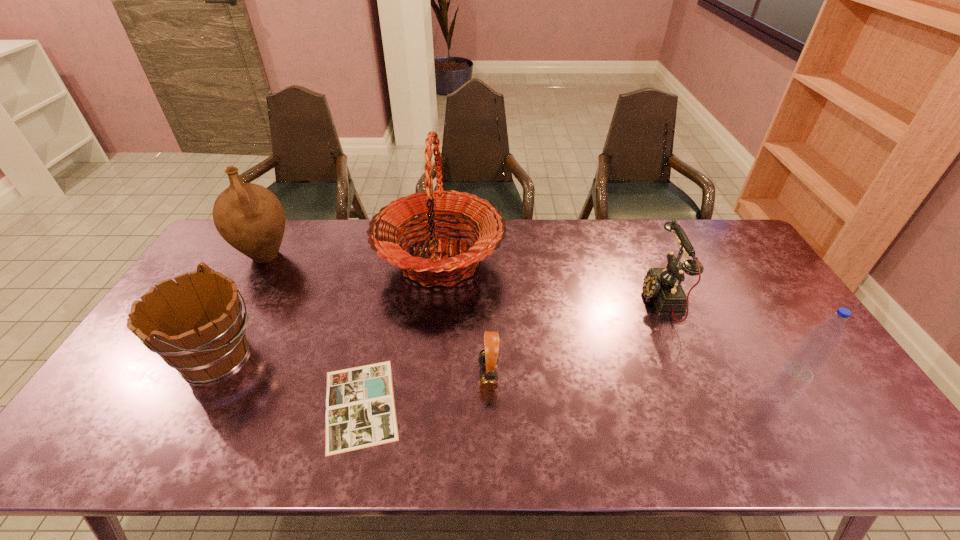
Identify the location of free spot located 0.280m on the dial of the telephone. (554, 300).

Where is `free point located 0.280m on the dial of the telephone`? The height and width of the screenshot is (540, 960). free point located 0.280m on the dial of the telephone is located at coordinates (554, 300).

You are a GUI agent. You are given a task and a screenshot of the screen. Output one action in this format:
    pyautogui.click(x=<x>, y=<y>)
    Task: Click on the vacant area situated 0.130m on the dial of the telephone
    
    Given the screenshot: What is the action you would take?
    pyautogui.click(x=602, y=300)

Where is `blank area located on the left of the rightmost object`? blank area located on the left of the rightmost object is located at coordinates (661, 372).

The image size is (960, 540). Find the location of `free space located on the ear cups of the headset`. free space located on the ear cups of the headset is located at coordinates (372, 376).

Locate an element on the screen. The height and width of the screenshot is (540, 960). vacant space located 0.140m on the ear cups of the headset is located at coordinates (425, 376).

This screenshot has height=540, width=960. Find the location of `free region located on the ear cups of the headset`. free region located on the ear cups of the headset is located at coordinates (337, 376).

This screenshot has height=540, width=960. Find the location of `vacant area situated 0.300m on the right of the book`. vacant area situated 0.300m on the right of the book is located at coordinates (525, 404).

Locate an element on the screen. basket that is at the far edge is located at coordinates (436, 206).

Locate an element on the screen. pitcher that is positioned at the far edge is located at coordinates (249, 217).